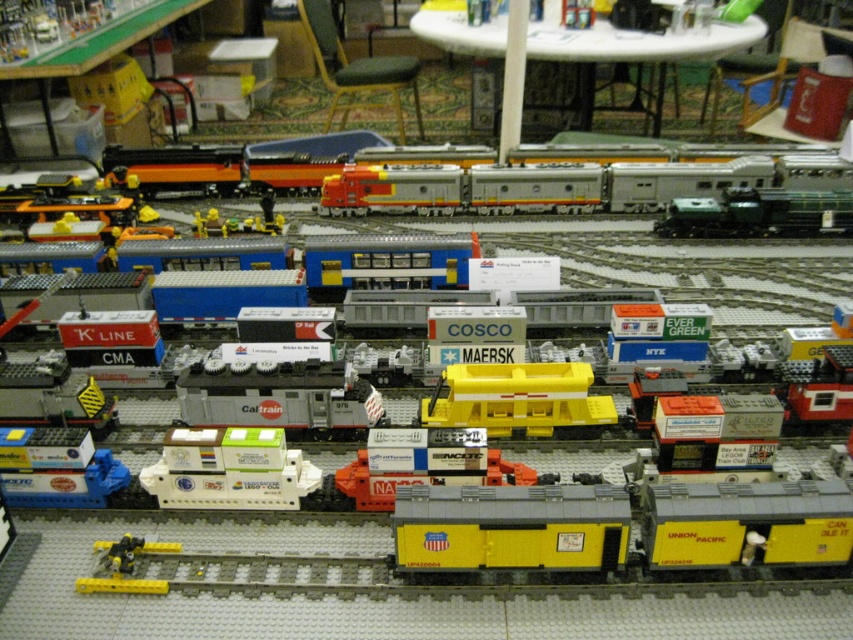
You are a model train enthusiast inspecting the layout. You notice the matte gray container at center and the blue plastic train car at lower left. Which object is blocking the path of the other?

The matte gray container at center is positioned over the blue plastic train car at lower left, so it is blocking the path of the blue plastic train car at lower left.

You are a model train enthusiast observing the LEGO train setup. You notice two points marked on the baseplate at coordinates point [672,426] and point [84,508]. Which point is positioned closer to your viewpoint as you look at the scene?

Point [672,426] is closer to the camera than point [84,508].